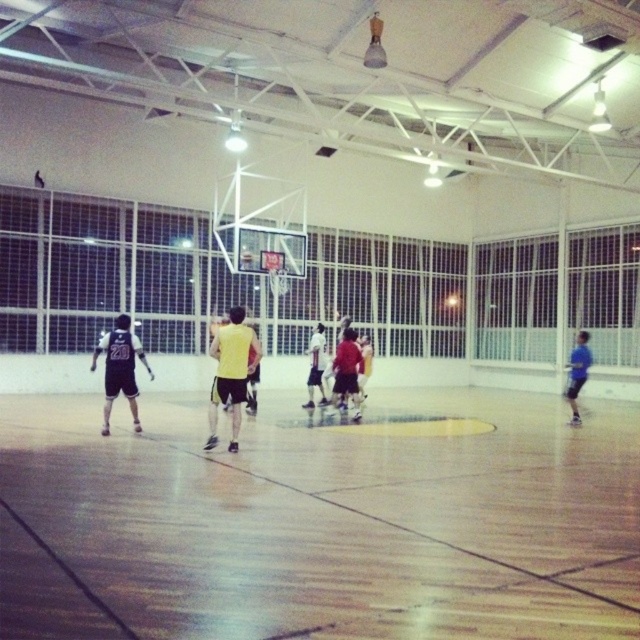
The image size is (640, 640). Describe the element at coordinates (230, 372) in the screenshot. I see `yellow matte basketball at center` at that location.

Based on the photo, which of these two, yellow matte basketball at center or matte red jersey at center, stands shorter?

Standing shorter between the two is yellow matte basketball at center.

Between point (122, 340) and point (362, 394), which one is positioned behind?

Point (362, 394)

Identify the location of yellow matte basketball at center. (230, 372).

Does matte red jersey at center have a greater width compared to blue matte shirt at right?

In fact, matte red jersey at center might be narrower than blue matte shirt at right.

This screenshot has height=640, width=640. I want to click on matte red jersey at center, so click(348, 371).

Consider the image. Who is more forward, (x=253, y=342) or (x=112, y=403)?

Point (x=253, y=342) is in front.

Can you confirm if yellow matte basketball player at center is bigger than matte black jersey at left?

No.

Where is `yellow matte basketball player at center`? This screenshot has width=640, height=640. yellow matte basketball player at center is located at coordinates 230,371.